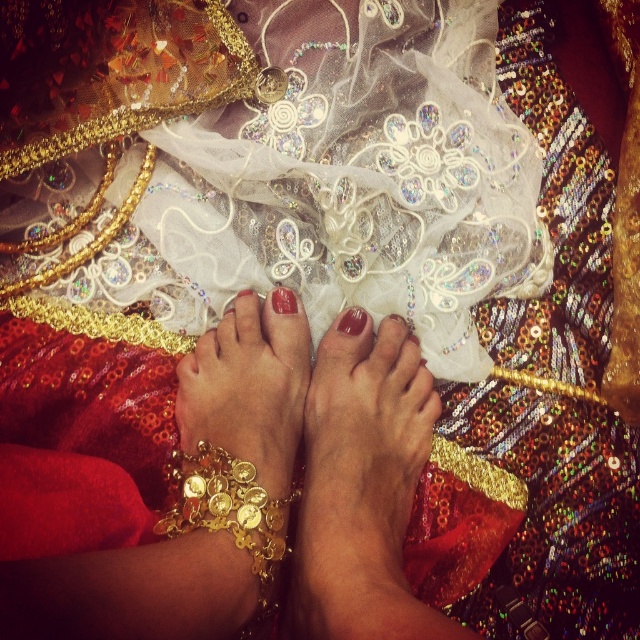
You are a fashion designer examining the image of feet with red nail polish. You need to determine the spatial relationship between the satin skin at center and the glossy nail polish at center. Which object is closer to the viewer?

The satin skin at center is closer to the viewer because it is in front of the glossy nail polish at center.

Based on the photo, you are a jeweler examining the gold metallic anklet at center and the matte gold toe at center. Which object would require more material to craft?

The gold metallic anklet at center requires more material because it is larger in size than the matte gold toe at center.